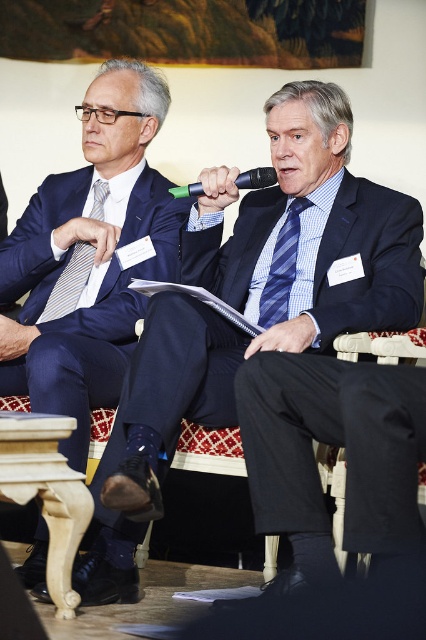
You are an event planner arranging seating for a panel discussion. You need to place a name tag holder on the table in front of the matte black suit at center so it is closer to the striped fabric tie at left than to the speaker. Is this possible given their positions?

The matte black suit at center is in front of the striped fabric tie at left, so placing the name tag holder directly in front of the matte black suit at center would position it closer to the striped fabric tie at left than to the speaker.